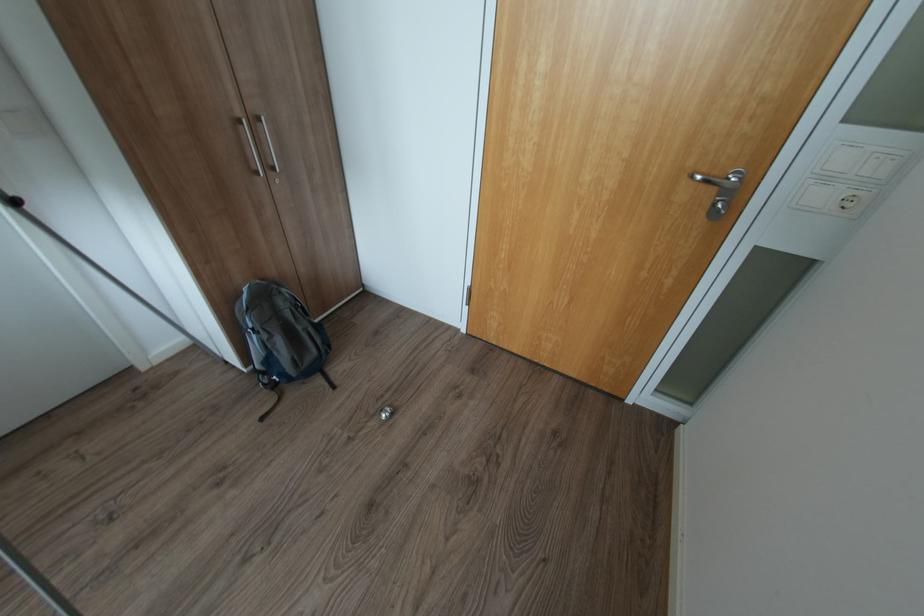
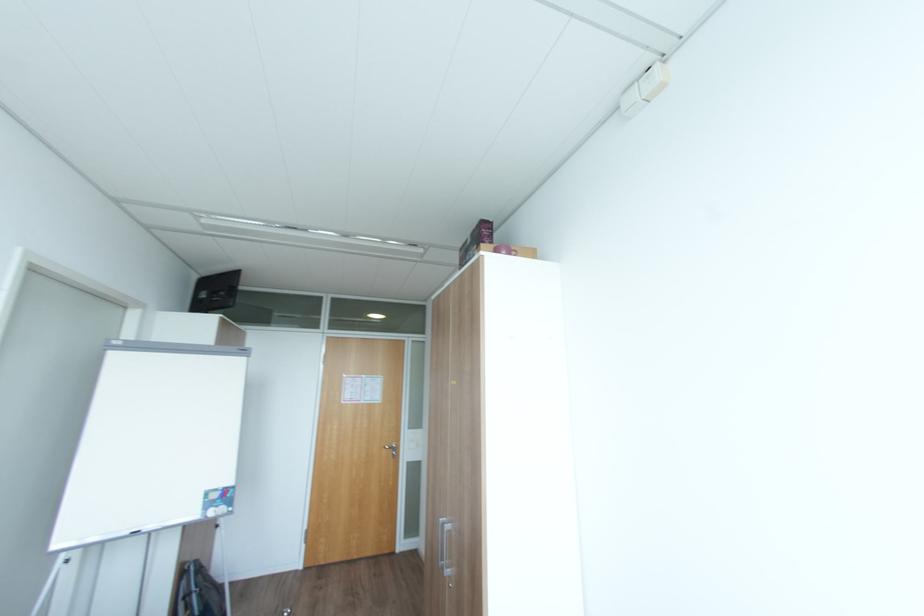
In the second image, find the point that corresponds to [703,177] in the first image.

(392, 448)